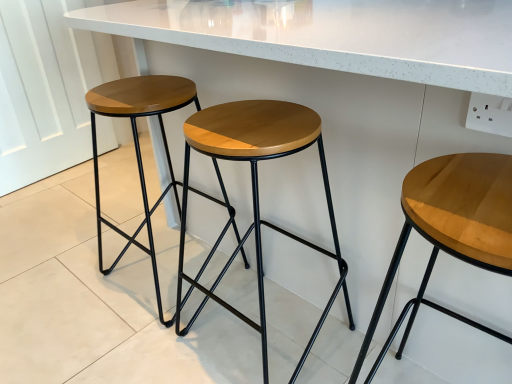
Image resolution: width=512 pixels, height=384 pixels. I want to click on free location above wooden/matte stool at center, positioned as the second stool in left-to-right order (from a real-world perspective), so click(251, 124).